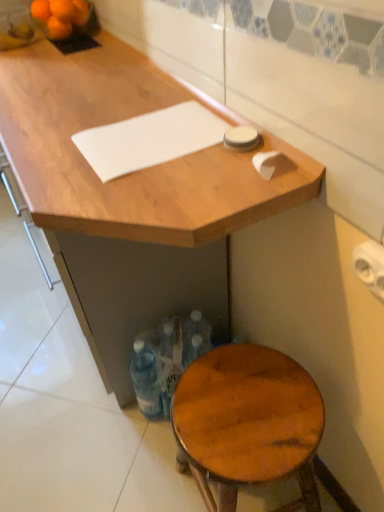
Where is `vacant space in white matte cutting board at upper center (from a real-world perspective)`? vacant space in white matte cutting board at upper center (from a real-world perspective) is located at coordinates (150, 136).